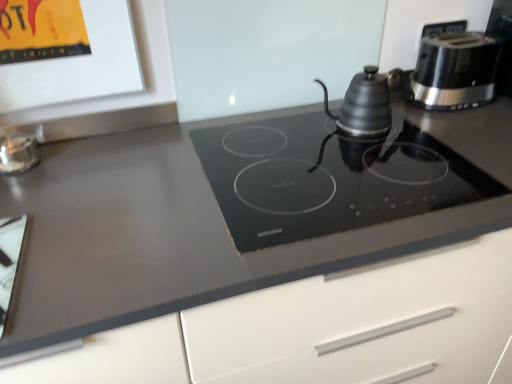
Question: Could you tell me if white glossy cutting board at lower left, which ranks as the second appliance in top-to-bottom order, is turned towards clear glass jar at left, which is the second appliance in front-to-back order?

Choices:
 (A) yes
 (B) no

Answer: (B)

Question: From the image's perspective, is white glossy cutting board at lower left, which is the 1th appliance in bottom-to-top order, beneath clear glass jar at left, which is the second appliance in front-to-back order?

Choices:
 (A) no
 (B) yes

Answer: (B)

Question: Is white glossy cutting board at lower left, which is counted as the 1th appliance, starting from the front, bigger than clear glass jar at left, the 2th appliance from the bottom?

Choices:
 (A) yes
 (B) no

Answer: (A)

Question: Is clear glass jar at left, placed as the 1th appliance when sorted from top to bottom, surrounded by white glossy cutting board at lower left, which is counted as the 1th appliance, starting from the front?

Choices:
 (A) no
 (B) yes

Answer: (A)

Question: From the image's perspective, does white glossy cutting board at lower left, which is the 1th appliance in bottom-to-top order, appear higher than clear glass jar at left, the 2th appliance from the bottom?

Choices:
 (A) yes
 (B) no

Answer: (B)

Question: In terms of height, does black plastic toaster at upper right, arranged as the second kitchen appliance when viewed from the left, look taller or shorter compared to black glass cooktop at center?

Choices:
 (A) short
 (B) tall

Answer: (B)

Question: Considering the positions of black plastic toaster at upper right, arranged as the second kitchen appliance when viewed from the left, and black glass cooktop at center in the image, is black plastic toaster at upper right, arranged as the second kitchen appliance when viewed from the left, wider or thinner than black glass cooktop at center?

Choices:
 (A) wide
 (B) thin

Answer: (B)

Question: Looking at the image, does black plastic toaster at upper right, acting as the first kitchen appliance starting from the right, seem bigger or smaller compared to black glass cooktop at center?

Choices:
 (A) big
 (B) small

Answer: (B)

Question: Do you think black plastic toaster at upper right, arranged as the second kitchen appliance when viewed from the left, is within black glass cooktop at center, or outside of it?

Choices:
 (A) outside
 (B) inside

Answer: (A)

Question: From the image's perspective, is black glass cooktop at center above or below matte black kettle at upper right, the first kitchen appliance viewed from the left?

Choices:
 (A) below
 (B) above

Answer: (A)

Question: In the image, is black glass cooktop at center positioned in front of or behind matte black kettle at upper right, the first kitchen appliance viewed from the left?

Choices:
 (A) behind
 (B) front

Answer: (B)

Question: Is black glass cooktop at center inside or outside of matte black kettle at upper right, the 2th kitchen appliance positioned from the right?

Choices:
 (A) outside
 (B) inside

Answer: (A)

Question: Is point (466, 165) closer or farther from the camera than point (366, 94)?

Choices:
 (A) farther
 (B) closer

Answer: (B)

Question: From a real-world perspective, is white glossy cutting board at lower left, which is the 1th appliance in bottom-to-top order, physically located above or below black plastic toaster at upper right, acting as the first kitchen appliance starting from the right?

Choices:
 (A) below
 (B) above

Answer: (A)

Question: Is point (5, 294) closer or farther from the camera than point (473, 89)?

Choices:
 (A) closer
 (B) farther

Answer: (A)